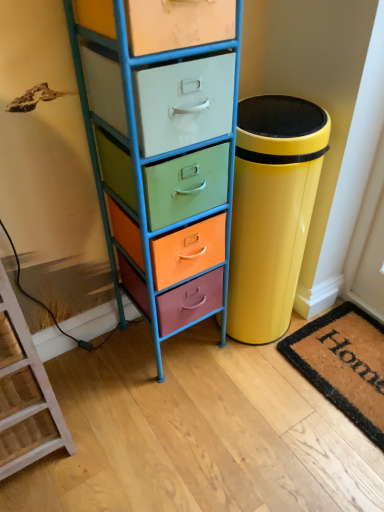
Question: Relative to coir doormat at lower right, is wooden ladder at lower left in front or behind?

Choices:
 (A) front
 (B) behind

Answer: (A)

Question: From a real-world perspective, is wooden ladder at lower left above or below coir doormat at lower right?

Choices:
 (A) above
 (B) below

Answer: (A)

Question: Considering the real-world distances, which object is closest to the wooden ladder at lower left?

Choices:
 (A) coir doormat at lower right
 (B) glossy yellow trash can at right
 (C) metallic multi-colored chest of drawers at left

Answer: (C)

Question: Which of these objects is positioned farthest from the wooden ladder at lower left?

Choices:
 (A) coir doormat at lower right
 (B) glossy yellow trash can at right
 (C) metallic multi-colored chest of drawers at left

Answer: (A)